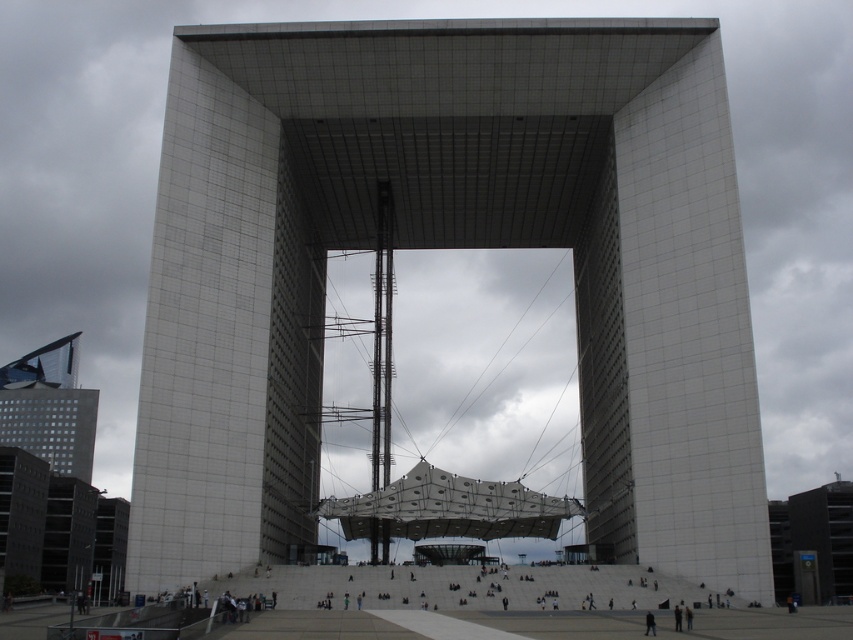
Question: Which object appears farthest from the camera in this image?

Choices:
 (A) matte glass skyscraper at left
 (B) white textured tower at center

Answer: (A)

Question: Is white textured tower at center thinner than matte glass skyscraper at left?

Choices:
 (A) yes
 (B) no

Answer: (B)

Question: Does white textured tower at center appear on the right side of matte glass skyscraper at left?

Choices:
 (A) no
 (B) yes

Answer: (B)

Question: Which point appears closest to the camera in this image?

Choices:
 (A) (688, 321)
 (B) (47, 401)

Answer: (A)

Question: Which of the following is the closest to the observer?

Choices:
 (A) matte glass skyscraper at left
 (B) white textured tower at center

Answer: (B)

Question: Is white textured tower at center wider than matte glass skyscraper at left?

Choices:
 (A) yes
 (B) no

Answer: (A)